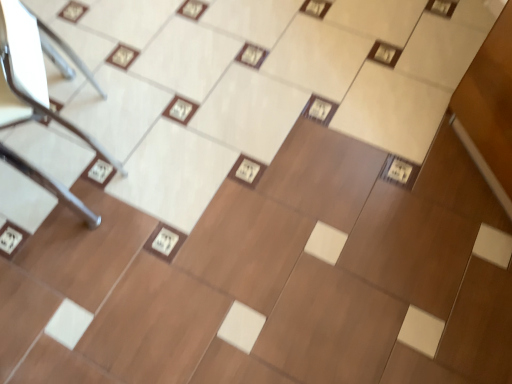
This screenshot has width=512, height=384. What do you see at coordinates (28, 75) in the screenshot?
I see `white plastic chair at upper left` at bounding box center [28, 75].

Where is `white plastic chair at upper left`? white plastic chair at upper left is located at coordinates click(28, 75).

In order to face white plastic chair at upper left, should I rotate leftwards or rightwards?

You should rotate left by 30.978 degrees.

Find the location of `white plastic chair at upper left`. white plastic chair at upper left is located at coordinates (28, 75).